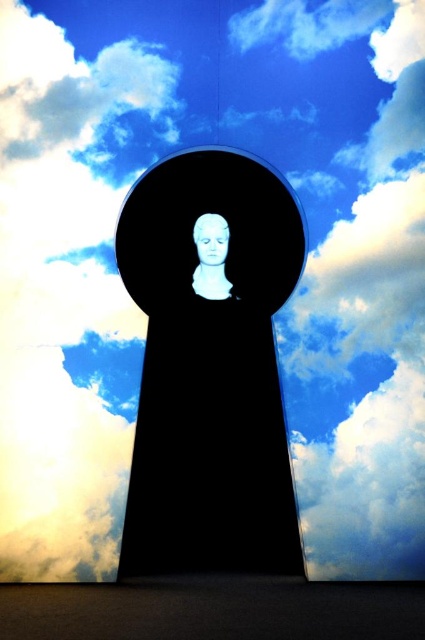
You are an art conservator standing in front of the white marble bust at center. The museum requires that all visitors maintain a minimum distance of 6 meters from the artwork to prevent damage. Are you currently violating this rule?

The white marble bust at center is 5.78 meters from the viewer, which is less than the required 6 meters. Therefore, you are violating the museum rule.

Based on the photo, you are an art student analyzing the composition of the image. You notice the white marble bust at center and the white matte face at center. Which object is positioned lower in the scene?

The white marble bust at center is positioned lower than the white matte face at center.

You are an art curator examining the image. You need to determine the spatial relationship between the white marble bust at center and the white matte face at center. Which object is taller?

The white marble bust at center is taller than the white matte face at center.